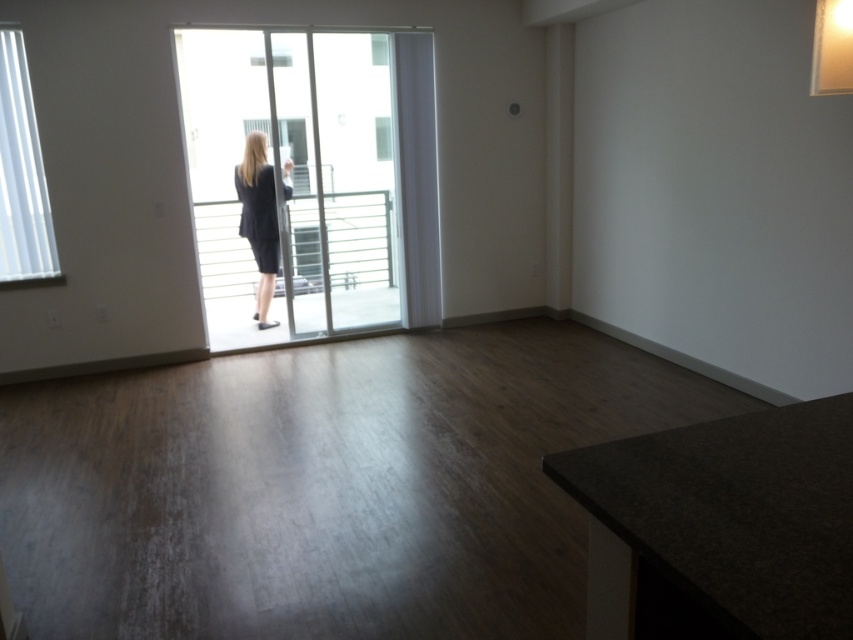
You are organizing a fashion show and need to arrange the matte black suit at center and the dark gray matte dress at center according to their positions in the image. Which one should be placed higher up on the runway?

The dark gray matte dress at center should be placed higher up on the runway because the matte black suit at center is located below it in the image.

You are standing in the living room and want to go to the balcony through the sliding glass doors. There is a white frosted glass window at upper left represented by point (21, 173). Can you walk through the white frosted glass window at upper left to reach the balcony?

The white frosted glass window at upper left is represented by point (21, 173). Since windows are typically not walkable surfaces, you cannot walk through the white frosted glass window at upper left to reach the balcony. The sliding glass doors mentioned in the scene description are likely the exit point.

You are standing in the living room and want to determine which object takes up more visual space in the scene. Which one is larger between the white frosted glass window at upper left and the dark gray matte dress at center?

The dark gray matte dress at center occupies more visual space than the white frosted glass window at upper left according to the description.